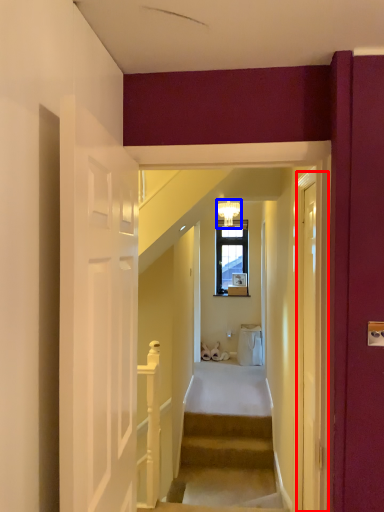
Question: Among these objects, which one is nearest to the camera, glass door (highlighted by a red box) or light fixture (highlighted by a blue box)?

Choices:
 (A) glass door
 (B) light fixture

Answer: (A)